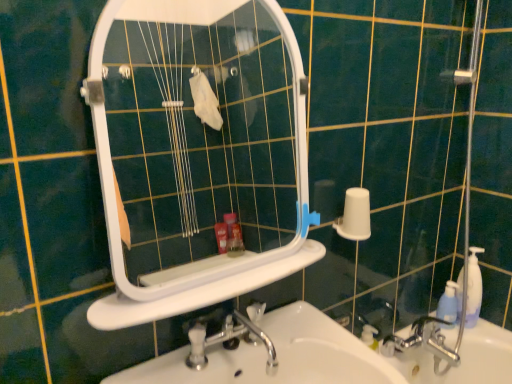
Locate an element on the screen. This screenshot has height=384, width=512. white plastic ledge at center is located at coordinates (199, 292).

Describe the element at coordinates (212, 130) in the screenshot. I see `white plastic mirror at upper center` at that location.

This screenshot has height=384, width=512. I want to click on translucent plastic soap dispenser at right, so click(x=473, y=288).

Find the location of `white matte toilet paper at right`. white matte toilet paper at right is located at coordinates (355, 215).

Where is `white plastic ledge at center`? white plastic ledge at center is located at coordinates 199,292.

Considering the positions of point (244, 79) and point (348, 233), is point (244, 79) closer or farther from the camera than point (348, 233)?

Point (244, 79) appears to be farther away from the viewer than point (348, 233).

Locate an element on the screen. The width and height of the screenshot is (512, 384). toilet paper located underneath the white plastic mirror at upper center (from a real-world perspective) is located at coordinates (355, 215).

Is white plastic mirror at upper center turned away from white matte toilet paper at right?

white plastic mirror at upper center does not have its back to white matte toilet paper at right.

Which of these two, white plastic mirror at upper center or white matte toilet paper at right, is bigger?

white plastic mirror at upper center.

Between white plastic mirror at upper center and white glossy sink at lower center, which one has more height?

Standing taller between the two is white plastic mirror at upper center.

Can you see white plastic mirror at upper center touching white glossy sink at lower center?

No, white plastic mirror at upper center is not making contact with white glossy sink at lower center.

From a real-world perspective, who is located lower, white plastic mirror at upper center or white glossy sink at lower center?

white glossy sink at lower center, from a real-world perspective.

How much distance is there between white plastic mirror at upper center and white glossy sink at lower center?

white plastic mirror at upper center is 4.96 feet from white glossy sink at lower center.

Based on the photo, considering the sizes of objects white matte toilet paper at right and translucent plastic soap dispenser at right in the image provided, who is taller, white matte toilet paper at right or translucent plastic soap dispenser at right?

translucent plastic soap dispenser at right.

Considering the relative sizes of white matte toilet paper at right and translucent plastic soap dispenser at right in the image provided, is white matte toilet paper at right bigger than translucent plastic soap dispenser at right?

No.

Does white matte toilet paper at right appear on the left side of translucent plastic soap dispenser at right?

Correct, you'll find white matte toilet paper at right to the left of translucent plastic soap dispenser at right.

Considering the sizes of white plastic mirror at upper center and translucent plastic soap dispenser at right in the image, is white plastic mirror at upper center bigger or smaller than translucent plastic soap dispenser at right?

Clearly, white plastic mirror at upper center is larger in size than translucent plastic soap dispenser at right.

Which of these two, white plastic mirror at upper center or translucent plastic soap dispenser at right, stands taller?

white plastic mirror at upper center is taller.

Is the depth of white plastic mirror at upper center greater than that of translucent plastic soap dispenser at right?

No, white plastic mirror at upper center is closer to the camera.

Is point (228, 272) closer or farther from the camera than point (466, 320)?

Point (228, 272).

Based on the photo, what's the angular difference between white glossy sink at lower center and white plastic mirror at upper center's facing directions?

0.889 degrees.

Is white glossy sink at lower center oriented towards white plastic mirror at upper center?

No, white glossy sink at lower center is not oriented towards white plastic mirror at upper center.

From the picture: From a real-world perspective, does white glossy sink at lower center stand above white plastic mirror at upper center?

Incorrect, from a real-world perspective, white glossy sink at lower center is lower than white plastic mirror at upper center.

Are white glossy sink at lower center and white plastic mirror at upper center far apart?

Absolutely, white glossy sink at lower center is distant from white plastic mirror at upper center.

From a real-world perspective, is blue translucent bottle at right physically located above or below white matte toilet paper at right?

blue translucent bottle at right is situated lower than white matte toilet paper at right in the real world.

Considering the sizes of blue translucent bottle at right and white matte toilet paper at right in the image, is blue translucent bottle at right wider or thinner than white matte toilet paper at right?

In the image, blue translucent bottle at right appears to be more narrow than white matte toilet paper at right.

Which is in front, blue translucent bottle at right or white matte toilet paper at right?

white matte toilet paper at right is closer to the camera.

Which of these two, translucent plastic soap dispenser at right or blue translucent bottle at right, stands shorter?

Standing shorter between the two is blue translucent bottle at right.

Between translucent plastic soap dispenser at right and blue translucent bottle at right, which one is positioned in front?

translucent plastic soap dispenser at right is more forward.

Is translucent plastic soap dispenser at right smaller than blue translucent bottle at right?

No.

Does point (475, 259) appear closer or farther from the camera than point (452, 310)?

Point (475, 259) is positioned closer to the camera compared to point (452, 310).

Locate an element on the screen. This screenshot has width=512, height=384. toilet paper below the white plastic mirror at upper center (from the image's perspective) is located at coordinates (355, 215).

Where is `mirror above the white glossy sink at lower center (from the image's perspective)`? This screenshot has height=384, width=512. mirror above the white glossy sink at lower center (from the image's perspective) is located at coordinates (212, 130).

Estimate the real-world distances between objects in this image. Which object is closer to white glossy sink at lower center, white plastic mirror at upper center or translucent plastic soap dispenser at right?

translucent plastic soap dispenser at right lies closer to white glossy sink at lower center than the other object.

Estimate the real-world distances between objects in this image. Which object is closer to white glossy sink at lower center, white matte toilet paper at right or white plastic mirror at upper center?

The object closer to white glossy sink at lower center is white matte toilet paper at right.

Estimate the real-world distances between objects in this image. Which object is further from white glossy sink at lower center, translucent plastic soap dispenser at right or white plastic ledge at center?

translucent plastic soap dispenser at right.

Estimate the real-world distances between objects in this image. Which object is further from white plastic mirror at upper center, white glossy sink at lower center or silver metallic faucet at lower right?

white glossy sink at lower center is positioned further to the anchor white plastic mirror at upper center.

Based on their spatial positions, is white plastic mirror at upper center or white glossy sink at lower center closer to translucent plastic soap dispenser at right?

white glossy sink at lower center is positioned closer to the anchor translucent plastic soap dispenser at right.

Considering their positions, is white plastic mirror at upper center positioned closer to translucent plastic soap dispenser at right than blue translucent bottle at right?

blue translucent bottle at right is positioned closer to the anchor translucent plastic soap dispenser at right.

Based on their spatial positions, is blue translucent bottle at right or white glossy sink at lower center closer to translucent plastic soap dispenser at right?

Among the two, blue translucent bottle at right is located nearer to translucent plastic soap dispenser at right.

Estimate the real-world distances between objects in this image. Which object is further from white plastic ledge at center, blue translucent bottle at right or white glossy sink at lower center?

blue translucent bottle at right is positioned further to the anchor white plastic ledge at center.

Locate an element on the screen. The image size is (512, 384). mirror between white glossy sink at lower center and white matte toilet paper at right in the front-back direction is located at coordinates click(212, 130).

The width and height of the screenshot is (512, 384). Find the location of `tap between white plastic ledge at center and translucent plastic soap dispenser at right`. tap between white plastic ledge at center and translucent plastic soap dispenser at right is located at coordinates (423, 342).

The height and width of the screenshot is (384, 512). I want to click on mirror between white glossy sink at lower center and blue translucent bottle at right in the front-back direction, so click(212, 130).

What are the coordinates of `soap dispenser between silver metallic faucet at lower right and blue translucent bottle at right from front to back` in the screenshot? It's located at 473,288.